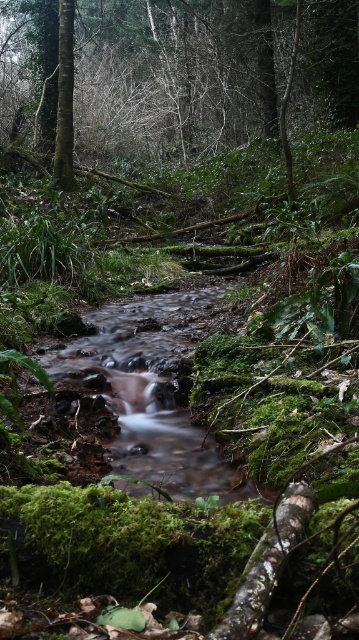
Question: Which point is closer to the camera?

Choices:
 (A) clear water at center
 (B) green mossy tree at center

Answer: (A)

Question: Which object appears closest to the camera in this image?

Choices:
 (A) clear water at center
 (B) green mossy tree at center

Answer: (A)

Question: In this image, where is green mossy tree at center located relative to clear water at center?

Choices:
 (A) above
 (B) below

Answer: (A)

Question: Which point is farther to the camera?

Choices:
 (A) (49, 12)
 (B) (216, 301)

Answer: (A)

Question: Does green mossy tree at center come in front of clear water at center?

Choices:
 (A) yes
 (B) no

Answer: (B)

Question: From the image, what is the correct spatial relationship of green mossy tree at center in relation to clear water at center?

Choices:
 (A) below
 (B) above

Answer: (B)